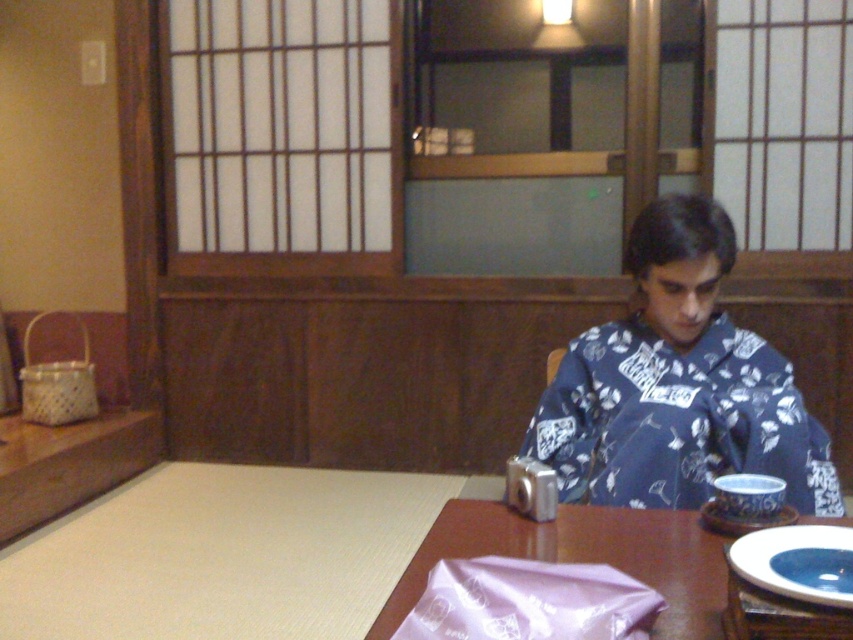
You are setting up a small tea ceremony in the traditional Japanese room. You have a brown wooden table at center and a blue glossy plate at lower right. Which object should you place the tea set on to ensure it fits properly?

The brown wooden table at center is bigger than the blue glossy plate at lower right, so the tea set should be placed on the brown wooden table at center to ensure it fits properly.

You are a guest at a Japanese inn and need to place a small accessory on the table. The blue floral kimono at center is currently on the table. Can you place the accessory on the blue glossy plate at lower right without moving the kimono?

The blue floral kimono at center is positioned over blue glossy plate at lower right, so the plate is covered by the kimono. You cannot place the accessory on the blue glossy plate at lower right without moving the kimono.

You are arranging items in a traditional Japanese room and need to place the blue floral kimono at center and the blue glossy plate at lower right. According to the scene description, where should you position the blue floral kimono relative to the blue glossy plate?

The blue floral kimono at center should be positioned to the right of the blue glossy plate at lower right as per the description.